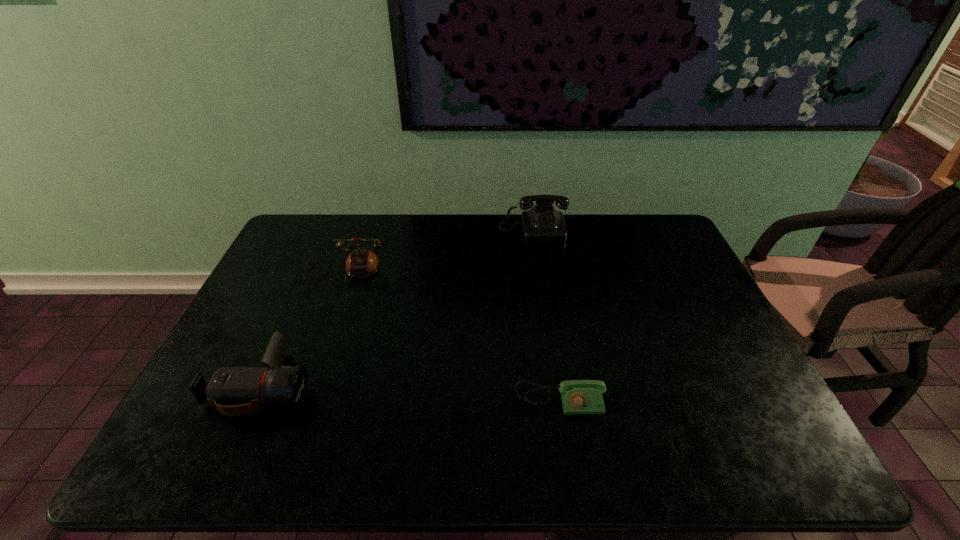
Where is `telephone object that ranks as the second closest to the camcorder`? Image resolution: width=960 pixels, height=540 pixels. telephone object that ranks as the second closest to the camcorder is located at coordinates (579, 397).

Locate an element on the screen. blank space that satisfies the following two spatial constraints: 1. on the dial of the farthest object; 2. on the lens of the camcorder is located at coordinates (558, 385).